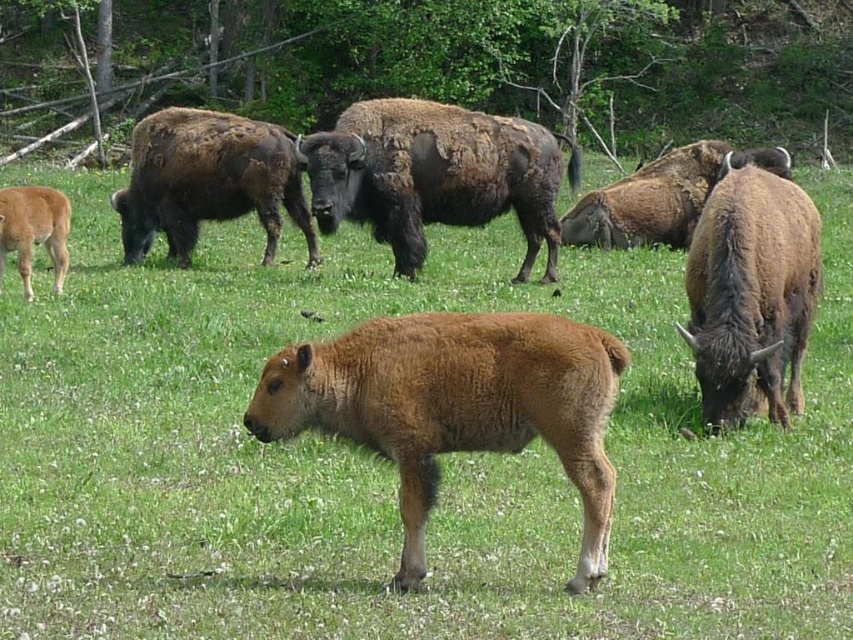
Question: Is brown furry calf at center to the left of brown fuzzy bison at right from the viewer's perspective?

Choices:
 (A) yes
 (B) no

Answer: (A)

Question: Which object is closer to the camera taking this photo?

Choices:
 (A) brown shaggy bison at center
 (B) light brown fur at lower left

Answer: (B)

Question: Based on their relative distances, which object is farther from the brown fuzzy bison at right?

Choices:
 (A) brown shaggy bison at center
 (B) brown fuzzy bison at upper left
 (C) brown furry calf at center

Answer: (B)

Question: Which is nearer to the brown shaggy bison at center?

Choices:
 (A) light brown fur at lower left
 (B) brown fuzzy bison at upper left

Answer: (B)

Question: Is the position of brown furry calf at center less distant than that of brown shaggy bison at center?

Choices:
 (A) no
 (B) yes

Answer: (B)

Question: Is brown furry calf at center wider than brown shaggy bison at center?

Choices:
 (A) yes
 (B) no

Answer: (B)